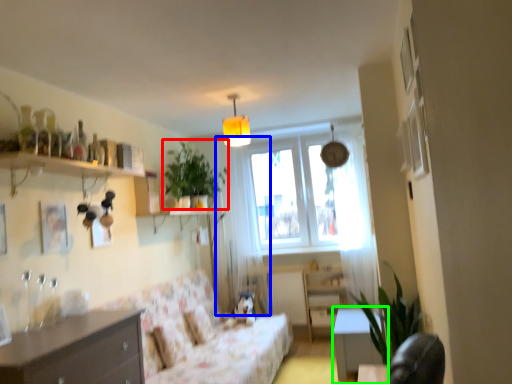
Question: Considering the real-world distances, which object is farthest from plant (highlighted by a red box)? curtain (highlighted by a blue box) or table (highlighted by a green box)?

Choices:
 (A) curtain
 (B) table

Answer: (B)